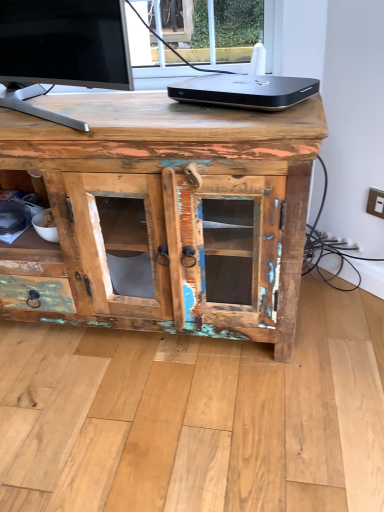
Identify the location of black metallic device at upper center. This screenshot has width=384, height=512. (244, 91).

This screenshot has height=512, width=384. Describe the element at coordinates (244, 91) in the screenshot. I see `black metallic device at upper center` at that location.

Image resolution: width=384 pixels, height=512 pixels. What do you see at coordinates (375, 203) in the screenshot?
I see `metallic beige switch at upper right` at bounding box center [375, 203].

In order to face rustic wood cabinet at center, should I rotate leftwards or rightwards?

Turn left approximately 11.285 degrees to face it.

At what (x,y) coordinates should I click in order to perform the action: click on black metallic device at upper center. Please return your answer as a coordinate pair (x, y). Looking at the image, I should click on (244, 91).

Is metallic beige switch at upper right a part of black metallic device at upper center?

No, metallic beige switch at upper right is not surrounded by black metallic device at upper center.

Based on the photo, which object is positioned more to the right, black metallic device at upper center or metallic beige switch at upper right?

metallic beige switch at upper right.

Between black metallic device at upper center and metallic beige switch at upper right, which one has larger width?

Wider between the two is black metallic device at upper center.

Looking at this image, considering the sizes of black metallic device at upper center and metallic beige switch at upper right in the image, is black metallic device at upper center taller or shorter than metallic beige switch at upper right?

Clearly, black metallic device at upper center is shorter compared to metallic beige switch at upper right.

Could you tell me if rustic wood cabinet at center is turned towards metallic beige switch at upper right?

No, rustic wood cabinet at center is not turned towards metallic beige switch at upper right.

Based on the photo, which of these two, rustic wood cabinet at center or metallic beige switch at upper right, is bigger?

With larger size is rustic wood cabinet at center.

Image resolution: width=384 pixels, height=512 pixels. In order to click on electric outlet on the right of rustic wood cabinet at center in this screenshot , I will do `click(375, 203)`.

From the image's perspective, relative to metallic beige switch at upper right, is rustic wood cabinet at center above or below?

From the image's perspective, rustic wood cabinet at center appears below metallic beige switch at upper right.

Consider the image. From a real-world perspective, is rustic wood cabinet at center physically below black metallic device at upper center?

Indeed, from a real-world perspective, rustic wood cabinet at center is positioned beneath black metallic device at upper center.

Is black metallic device at upper center completely or partially inside rustic wood cabinet at center?

That's incorrect, black metallic device at upper center is not inside rustic wood cabinet at center.

Which of these two, rustic wood cabinet at center or black metallic device at upper center, is bigger?

Bigger between the two is rustic wood cabinet at center.

Are rustic wood cabinet at center and black metallic device at upper center making contact?

They are not placed beside each other.

Do you think metallic beige switch at upper right is within black metallic device at upper center, or outside of it?

metallic beige switch at upper right is not inside black metallic device at upper center, it's outside.

Where is `electric outlet below the black metallic device at upper center (from a real-world perspective)`? The width and height of the screenshot is (384, 512). electric outlet below the black metallic device at upper center (from a real-world perspective) is located at coordinates (375, 203).

Is metallic beige switch at upper right oriented towards black metallic device at upper center?

No.

Is metallic beige switch at upper right far away from black metallic device at upper center?

No, there isn't a large distance between metallic beige switch at upper right and black metallic device at upper center.

Looking at this image, is black metallic device at upper center positioned with its back to rustic wood cabinet at center?

No.

Does black metallic device at upper center have a lesser height compared to rustic wood cabinet at center?

Indeed, black metallic device at upper center has a lesser height compared to rustic wood cabinet at center.

Is the position of black metallic device at upper center more distant than that of rustic wood cabinet at center?

Yes, black metallic device at upper center is further from the viewer.

In the image, is metallic beige switch at upper right on the left side or the right side of rustic wood cabinet at center?

Clearly, metallic beige switch at upper right is on the right of rustic wood cabinet at center in the image.

Considering the sizes of objects metallic beige switch at upper right and rustic wood cabinet at center in the image provided, who is shorter, metallic beige switch at upper right or rustic wood cabinet at center?

metallic beige switch at upper right is shorter.

Which is closer, (380, 203) or (232, 162)?

Point (380, 203) appears to be farther away from the viewer than point (232, 162).

Is metallic beige switch at upper right in contact with rustic wood cabinet at center?

metallic beige switch at upper right is not next to rustic wood cabinet at center, and they're not touching.

I want to click on laptop that appears in front of the metallic beige switch at upper right, so click(244, 91).

You are a GUI agent. You are given a task and a screenshot of the screen. Output one action in this format:
    pyautogui.click(x=<x>, y=<y>)
    Task: Click on the electric outlet below the rustic wood cabinet at center (from a real-world perspective)
    The width and height of the screenshot is (384, 512).
    Given the screenshot: What is the action you would take?
    pyautogui.click(x=375, y=203)

Considering their positions, is black metallic device at upper center positioned further to rustic wood cabinet at center than metallic beige switch at upper right?

The object further to rustic wood cabinet at center is metallic beige switch at upper right.

Considering their positions, is metallic beige switch at upper right positioned closer to black metallic device at upper center than rustic wood cabinet at center?

The object closer to black metallic device at upper center is rustic wood cabinet at center.

From the image, which object appears to be farther from metallic beige switch at upper right, rustic wood cabinet at center or black metallic device at upper center?

Based on the image, rustic wood cabinet at center appears to be further to metallic beige switch at upper right.

Based on their spatial positions, is black metallic device at upper center or rustic wood cabinet at center closer to metallic beige switch at upper right?

black metallic device at upper center.

Looking at the image, which one is located further to black metallic device at upper center, rustic wood cabinet at center or metallic beige switch at upper right?

metallic beige switch at upper right lies further to black metallic device at upper center than the other object.

Considering their positions, is metallic beige switch at upper right positioned closer to rustic wood cabinet at center than black metallic device at upper center?

The object closer to rustic wood cabinet at center is black metallic device at upper center.

Where is `laptop located between rustic wood cabinet at center and metallic beige switch at upper right in the left-right direction`? The height and width of the screenshot is (512, 384). laptop located between rustic wood cabinet at center and metallic beige switch at upper right in the left-right direction is located at coordinates (244, 91).